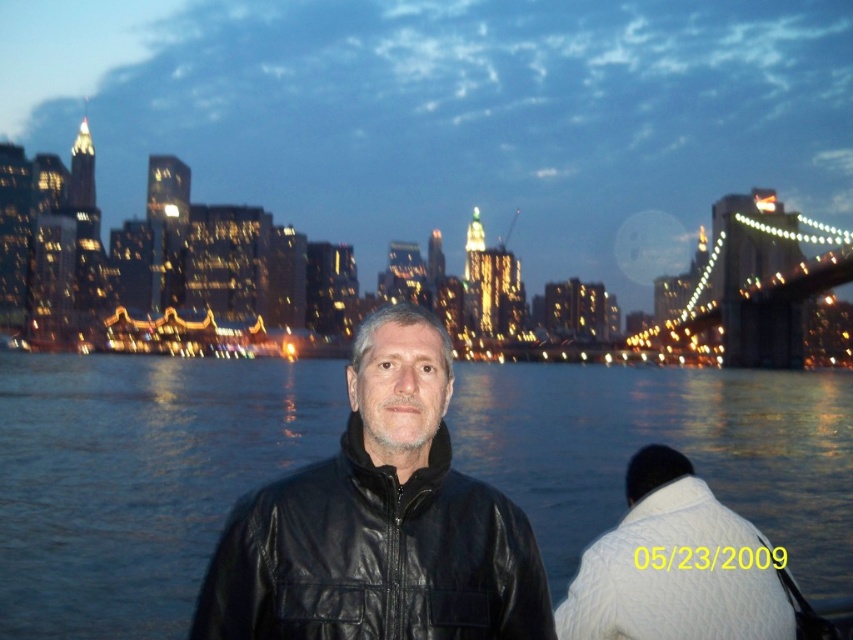
Question: Is white knitted sweater at lower right wider than metallic illuminated bridge at right?

Choices:
 (A) no
 (B) yes

Answer: (A)

Question: Does black leather jacket at center appear on the right side of metallic illuminated bridge at right?

Choices:
 (A) yes
 (B) no

Answer: (B)

Question: Can you confirm if blue water at center is positioned to the right of black leather jacket at center?

Choices:
 (A) no
 (B) yes

Answer: (A)

Question: Which object is the farthest from the black leather jacket at center?

Choices:
 (A) metallic illuminated bridge at right
 (B) blue water at center

Answer: (A)

Question: Which point is farther to the camera?

Choices:
 (A) (276, 604)
 (B) (10, 444)
 (C) (747, 541)

Answer: (B)

Question: Which point is closer to the camera?

Choices:
 (A) (825, 282)
 (B) (474, 506)
 (C) (682, 625)

Answer: (C)